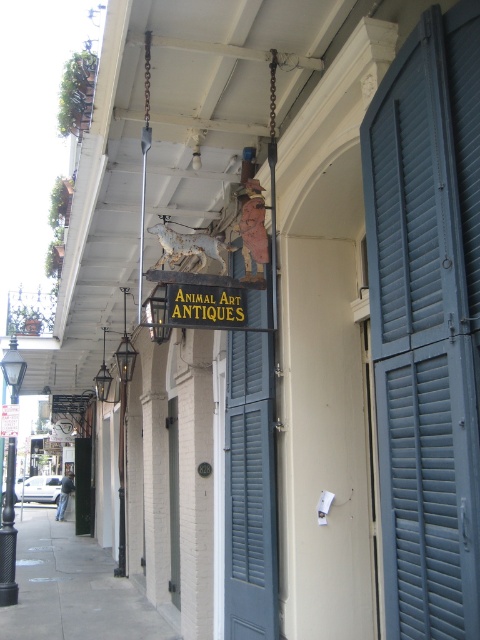
Question: Which object is positioned closest to the gold metallic sign at center?

Choices:
 (A) blue painted wood shutters at right
 (B) gray concrete sidewalk at lower left

Answer: (B)

Question: Does gray concrete sidewalk at lower left have a larger size compared to gold metallic sign at center?

Choices:
 (A) no
 (B) yes

Answer: (B)

Question: Which object appears closest to the camera in this image?

Choices:
 (A) blue painted wood shutters at right
 (B) gray concrete sidewalk at lower left

Answer: (A)

Question: Does blue painted wood shutters at right have a greater width compared to gray concrete sidewalk at lower left?

Choices:
 (A) yes
 (B) no

Answer: (B)

Question: Which is farther from the gray concrete sidewalk at lower left?

Choices:
 (A) gold metallic sign at center
 (B) blue painted wood shutters at right

Answer: (B)

Question: Can you confirm if blue painted wood shutters at right is positioned below gray concrete sidewalk at lower left?

Choices:
 (A) no
 (B) yes

Answer: (A)